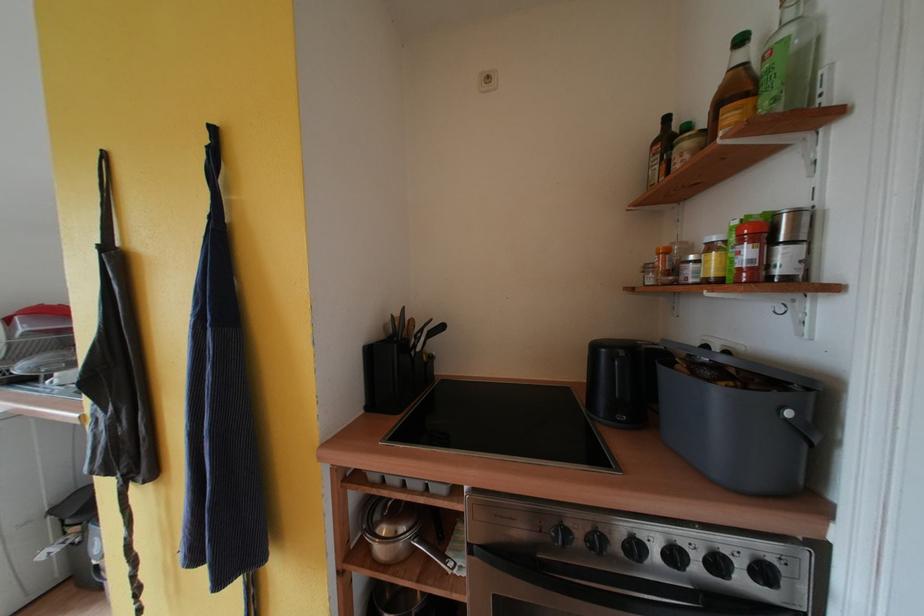
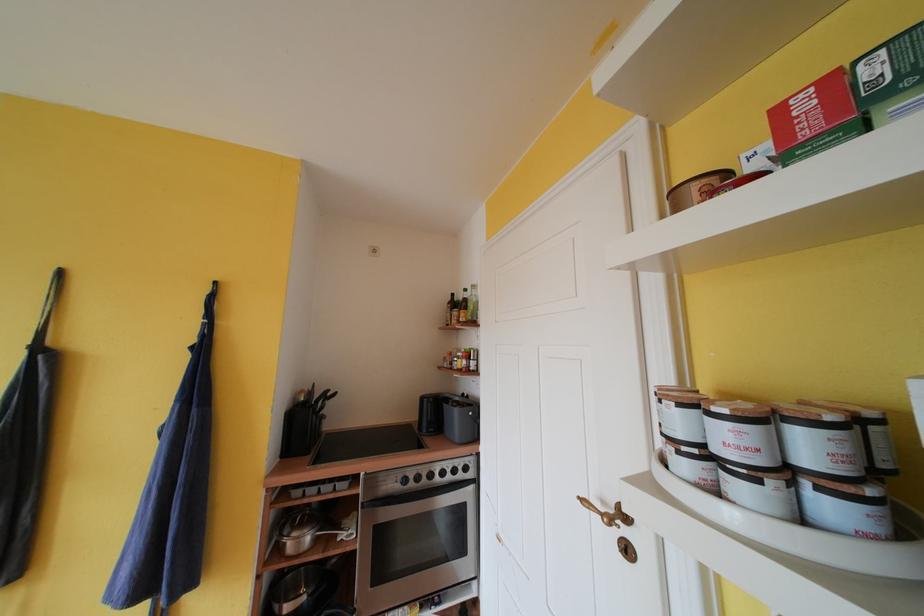
The point at (383, 521) is marked in the first image. Where is the corresponding point in the second image?

(293, 535)